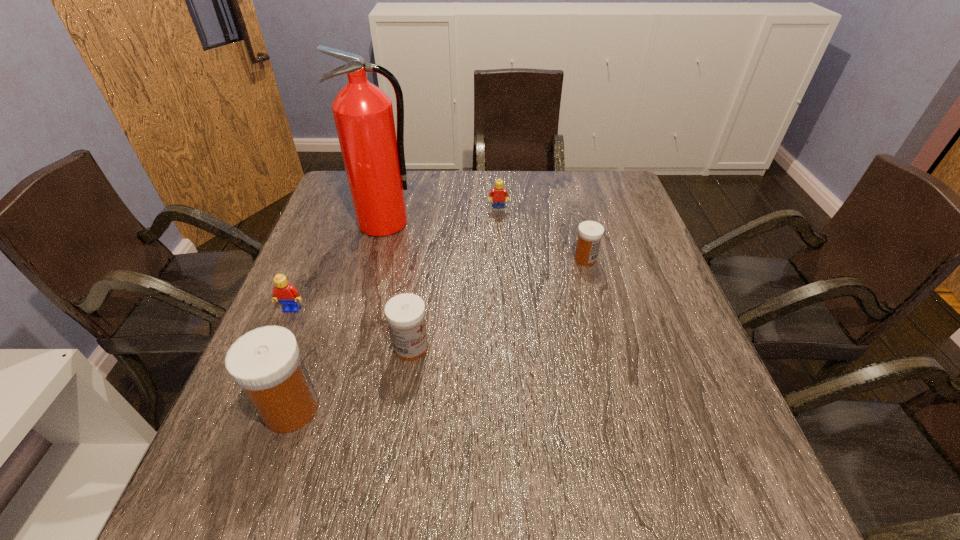
Where is `medicine present at the left edge`? This screenshot has width=960, height=540. medicine present at the left edge is located at coordinates (266, 362).

Where is `fire extinguisher that is at the left edge`? fire extinguisher that is at the left edge is located at coordinates (374, 160).

Where is `Lego that is at the left edge`? The height and width of the screenshot is (540, 960). Lego that is at the left edge is located at coordinates (287, 295).

Image resolution: width=960 pixels, height=540 pixels. I want to click on object positioned at the right edge, so click(590, 233).

Find the location of a particular element. object that is at the far left corner is located at coordinates coord(374,160).

Identify the location of object that is at the near left corner. (266, 362).

In the image, there is a desktop. What are the coordinates of `vacant space at the far edge` in the screenshot? It's located at (475, 179).

Find the location of `free space at the left edge of the desktop`. free space at the left edge of the desktop is located at coordinates (322, 373).

Find the location of a particular element. The image size is (960, 540). vacant region at the right edge of the desktop is located at coordinates (682, 384).

You are a GUI agent. You are given a task and a screenshot of the screen. Output one action in this format:
    pyautogui.click(x=<x>, y=<y>)
    Task: Click on the vacant space at the near left corner
    The width and height of the screenshot is (960, 540).
    Given the screenshot: What is the action you would take?
    pyautogui.click(x=234, y=410)